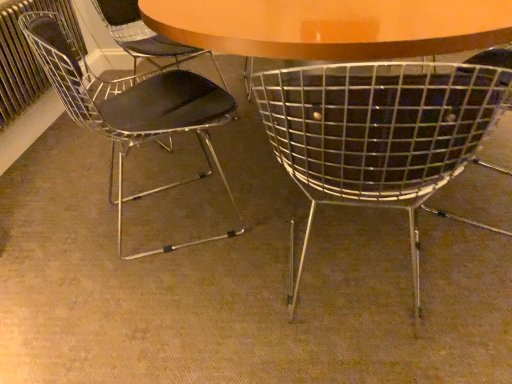
Locate an element on the screen. This screenshot has height=384, width=512. metallic radiator at left is located at coordinates (26, 56).

Is metal mesh chair at center, the first chair when ordered from right to left, touching metallic radiator at left?

metal mesh chair at center, the first chair when ordered from right to left, is not next to metallic radiator at left, and they're not touching.

Is metal mesh chair at center, which is the second chair in left-to-right order, outside of metallic radiator at left?

metal mesh chair at center, which is the second chair in left-to-right order, lies outside metallic radiator at left's area.

Does metal mesh chair at center, which is the second chair in left-to-right order, appear on the right side of metallic radiator at left?

Indeed, metal mesh chair at center, which is the second chair in left-to-right order, is positioned on the right side of metallic radiator at left.

Based on the photo, from a real-world perspective, which is physically below, metal mesh chair at center, the first chair when ordered from right to left, or metallic radiator at left?

metal mesh chair at center, the first chair when ordered from right to left, is physically lower.

Based on the photo, from a real-world perspective, is metallic radiator at left on metallic wire chair at left, which appears as the 2th chair when viewed from the right?

Yes.

From the image's perspective, who appears lower, metallic radiator at left or metallic wire chair at left, which appears as the 2th chair when viewed from the right?

From the image's view, metallic wire chair at left, which appears as the 2th chair when viewed from the right, is below.

Can you see metallic radiator at left touching metallic wire chair at left, the 1th chair from the left?

They are not placed beside each other.

Looking at the image, does metallic wire chair at left, the 1th chair from the left, seem bigger or smaller compared to metallic radiator at left?

Considering their sizes, metallic wire chair at left, the 1th chair from the left, takes up more space than metallic radiator at left.

Is metallic wire chair at left, which appears as the 2th chair when viewed from the right, positioned beyond the bounds of metallic radiator at left?

Yes.

Is metallic wire chair at left, the 1th chair from the left, in contact with metallic radiator at left?

metallic wire chair at left, the 1th chair from the left, and metallic radiator at left are not in contact.

Between metal mesh chair at center, which is the second chair in left-to-right order, and metallic wire chair at left, which appears as the 2th chair when viewed from the right, which one appears on the right side from the viewer's perspective?

From the viewer's perspective, metal mesh chair at center, which is the second chair in left-to-right order, appears more on the right side.

From the image's perspective, which is above, metal mesh chair at center, the first chair when ordered from right to left, or metallic wire chair at left, which appears as the 2th chair when viewed from the right?

metallic wire chair at left, which appears as the 2th chair when viewed from the right, appears higher in the image.

Is metal mesh chair at center, the first chair when ordered from right to left, turned away from metallic wire chair at left, the 1th chair from the left?

No, metal mesh chair at center, the first chair when ordered from right to left,'s orientation is not away from metallic wire chair at left, the 1th chair from the left.

Does point (29, 53) lie behind point (395, 161)?

Yes, point (29, 53) is behind point (395, 161).

Which of these two, metallic radiator at left or metal mesh chair at center, which is the second chair in left-to-right order, is bigger?

With larger size is metal mesh chair at center, which is the second chair in left-to-right order.

Considering the positions of objects metallic radiator at left and metal mesh chair at center, which is the second chair in left-to-right order, in the image provided, who is more to the right, metallic radiator at left or metal mesh chair at center, which is the second chair in left-to-right order,?

A: metal mesh chair at center, which is the second chair in left-to-right order.

Considering the positions of objects metallic wire chair at left, the 1th chair from the left, and metal mesh chair at center, which is the second chair in left-to-right order, in the image provided, who is in front, metallic wire chair at left, the 1th chair from the left, or metal mesh chair at center, which is the second chair in left-to-right order,?

metal mesh chair at center, which is the second chair in left-to-right order, is closer to the camera.

From the image's perspective, which one is positioned lower, metallic wire chair at left, which appears as the 2th chair when viewed from the right, or metal mesh chair at center, the first chair when ordered from right to left?

metal mesh chair at center, the first chair when ordered from right to left, from the image's perspective.

Looking at their sizes, would you say metallic wire chair at left, the 1th chair from the left, is wider or thinner than metal mesh chair at center, the first chair when ordered from right to left?

In the image, metallic wire chair at left, the 1th chair from the left, appears to be more narrow than metal mesh chair at center, the first chair when ordered from right to left.

Which is closer, (111, 138) or (481, 96)?

Positioned in front is point (481, 96).

At what (x,y) coordinates should I click in order to perform the action: click on the 2nd chair positioned below the metallic radiator at left (from the image's perspective). Please return your answer as a coordinate pair (x, y). The height and width of the screenshot is (384, 512). Looking at the image, I should click on (378, 136).

You are a GUI agent. You are given a task and a screenshot of the screen. Output one action in this format:
    pyautogui.click(x=<x>, y=<y>)
    Task: Click on the radiator that appears above the metallic wire chair at left, the 1th chair from the left (from the image's perspective)
    This screenshot has height=384, width=512.
    Given the screenshot: What is the action you would take?
    pyautogui.click(x=26, y=56)

When comparing their distances from metal mesh chair at center, the first chair when ordered from right to left, does metallic radiator at left or metallic wire chair at left, the 1th chair from the left, seem closer?

metallic wire chair at left, the 1th chair from the left, is positioned closer to the anchor metal mesh chair at center, the first chair when ordered from right to left.

Looking at the image, which one is located closer to metal mesh chair at center, the first chair when ordered from right to left, metallic wire chair at left, the 1th chair from the left, or metallic radiator at left?

metallic wire chair at left, the 1th chair from the left, is positioned closer to the anchor metal mesh chair at center, the first chair when ordered from right to left.

When comparing their distances from metallic radiator at left, does metallic wire chair at left, the 1th chair from the left, or metal mesh chair at center, the first chair when ordered from right to left, seem further?

The object further to metallic radiator at left is metal mesh chair at center, the first chair when ordered from right to left.

Estimate the real-world distances between objects in this image. Which object is closer to metallic wire chair at left, the 1th chair from the left, metallic radiator at left or metal mesh chair at center, which is the second chair in left-to-right order?

metallic radiator at left.

Estimate the real-world distances between objects in this image. Which object is further from metallic radiator at left, metal mesh chair at center, the first chair when ordered from right to left, or metallic wire chair at left, the 1th chair from the left?

The object further to metallic radiator at left is metal mesh chair at center, the first chair when ordered from right to left.

Estimate the real-world distances between objects in this image. Which object is closer to metallic wire chair at left, which appears as the 2th chair when viewed from the right, metal mesh chair at center, which is the second chair in left-to-right order, or metallic radiator at left?

metallic radiator at left lies closer to metallic wire chair at left, which appears as the 2th chair when viewed from the right, than the other object.

I want to click on chair between metallic radiator at left and metal mesh chair at center, the first chair when ordered from right to left, so click(131, 107).